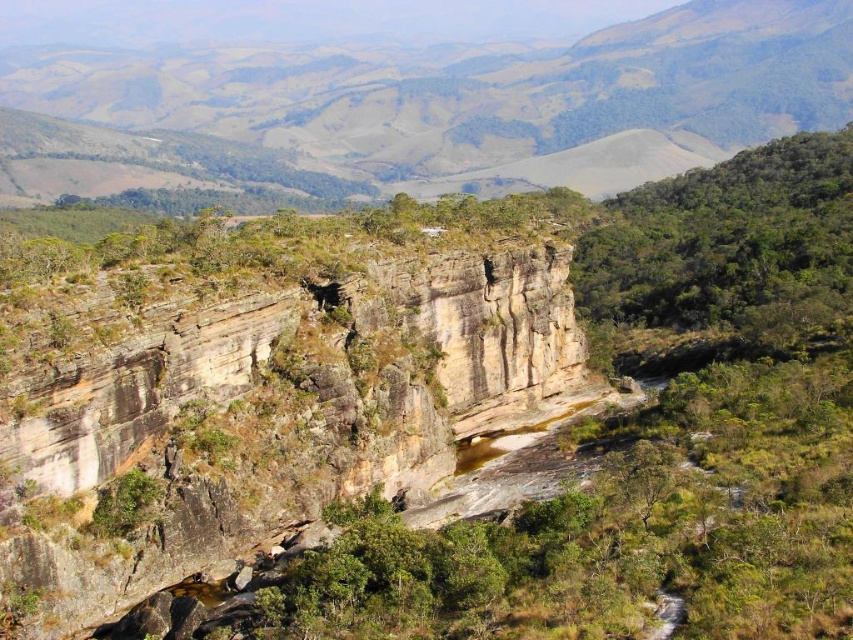
Does brown rough rock face at center come in front of brown rocky cliff at upper center?

Yes, it is.

What do you see at coordinates (277, 416) in the screenshot? The width and height of the screenshot is (853, 640). I see `brown rough rock face at center` at bounding box center [277, 416].

Which is behind, point (544, 381) or point (248, 108)?

The point (248, 108) is more distant.

Where is `brown rough rock face at center`? The image size is (853, 640). brown rough rock face at center is located at coordinates (277, 416).